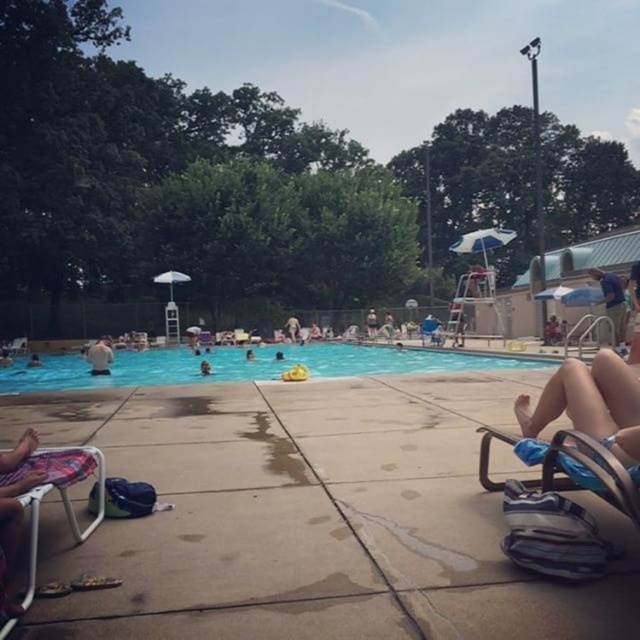
You are planning to place a 1.2 meter wide umbrella next to the plastic beach chair at lower left and the white matte shirt at upper left. Which object should you place the umbrella next to if you want it to fit without overlapping?

The plastic beach chair at lower left has a width less than the white matte shirt at upper left. Therefore, placing the umbrella next to the plastic beach chair at lower left would be more appropriate since it has a smaller width, allowing the umbrella to fit without overlapping.

You are a photographer trying to capture the perfect shot of the tan skin at lower right and the dark blue swimmer at center. Since you want to focus on both subjects equally, which subject should you adjust your camera to zoom in more on to ensure they appear the same size in the photo?

The tan skin at lower right has a lesser width compared to the dark blue swimmer at center, so you should zoom in more on the tan skin at lower right to make them appear the same size in the photo.